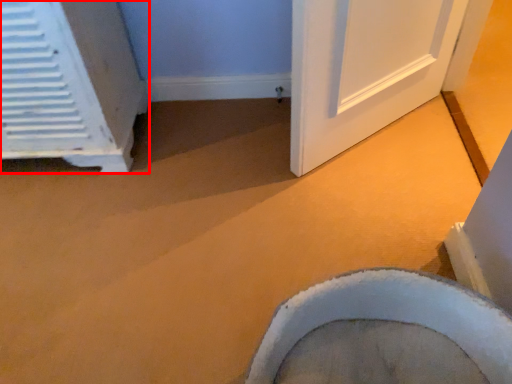
Question: From the image's perspective, where is air conditioning (annotated by the red box) located relative to toilet?

Choices:
 (A) above
 (B) below

Answer: (A)